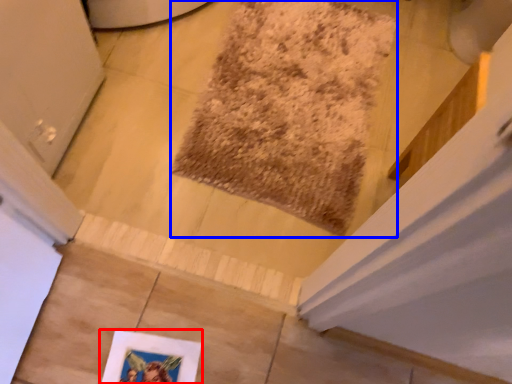
Question: Which of the following is the closest to the observer, picture frame (highlighted by a red box) or mat (highlighted by a blue box)?

Choices:
 (A) picture frame
 (B) mat

Answer: (A)